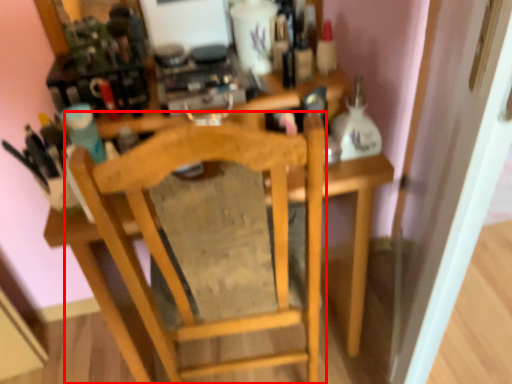
Question: From the image's perspective, where is chair (annotated by the red box) located relative to door?

Choices:
 (A) below
 (B) above

Answer: (A)